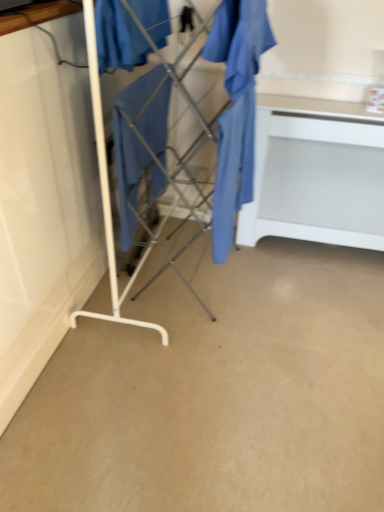
Question: From a real-world perspective, is beige carpet at center positioned above or below white matte table at center?

Choices:
 (A) below
 (B) above

Answer: (A)

Question: Is beige carpet at center taller or shorter than white matte table at center?

Choices:
 (A) short
 (B) tall

Answer: (A)

Question: Which of these objects is positioned closest to the white matte table at center?

Choices:
 (A) beige carpet at center
 (B) matte blue fabric at center, which is the 2th clothing in right-to-left order
 (C) matte blue fabric at center, the 1th clothing when ordered from left to right
 (D) matte blue fabric at center, the first clothing from the right
 (E) metal drying rack at center

Answer: (D)

Question: Estimate the real-world distances between objects in this image. Which object is farther from the beige carpet at center?

Choices:
 (A) matte blue fabric at center, arranged as the 3th clothing when viewed from the left
 (B) matte blue fabric at center, which is the 2th clothing in right-to-left order
 (C) metal drying rack at center
 (D) matte blue fabric at center, arranged as the 3th clothing when viewed from the right
 (E) white matte table at center

Answer: (D)